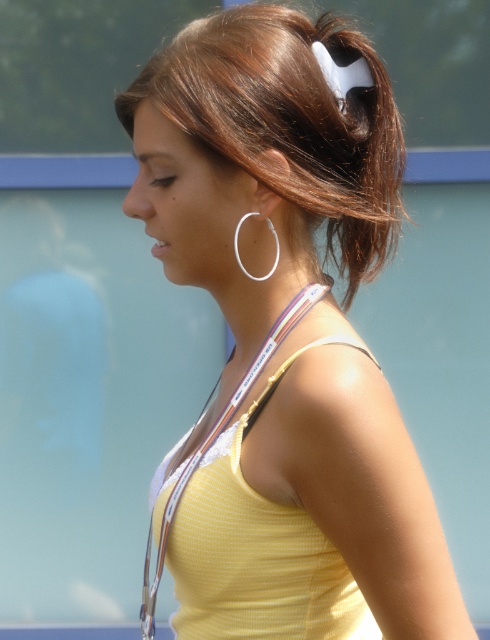
Question: Is brown shiny hair at upper center further to camera compared to silver metallic hoop at upper center?

Choices:
 (A) no
 (B) yes

Answer: (A)

Question: Can you confirm if brown shiny hair at upper center is bigger than silver metallic hoop at upper center?

Choices:
 (A) yes
 (B) no

Answer: (A)

Question: Which point is farther to the camera?

Choices:
 (A) (265, 275)
 (B) (309, 100)

Answer: (A)

Question: From the image, what is the correct spatial relationship of brown shiny hair at upper center in relation to silver metallic hoop at upper center?

Choices:
 (A) below
 (B) above

Answer: (B)

Question: Which point is closer to the camera taking this photo?

Choices:
 (A) click(x=294, y=40)
 (B) click(x=236, y=237)

Answer: (B)